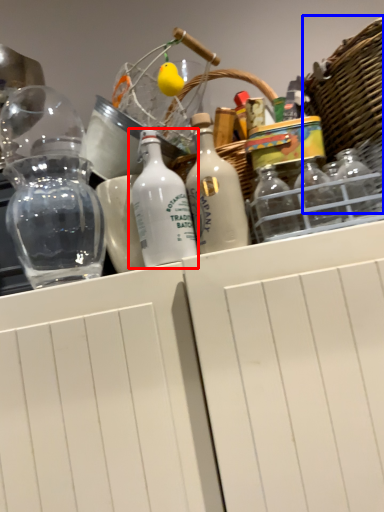
Question: Which object is further to the camera taking this photo, bottle (highlighted by a red box) or basket (highlighted by a blue box)?

Choices:
 (A) bottle
 (B) basket

Answer: (A)